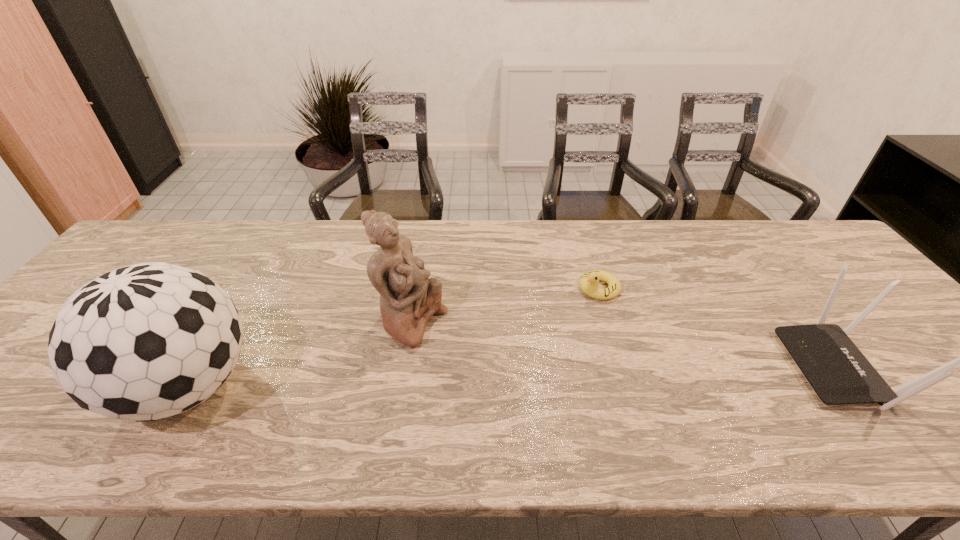
Where is `soccer ball`? soccer ball is located at coordinates (143, 342).

You are a GUI agent. You are given a task and a screenshot of the screen. Output one action in this format:
    pyautogui.click(x=<x>, y=<y>)
    Task: Click on the third tallest object
    
    Given the screenshot: What is the action you would take?
    pyautogui.click(x=838, y=372)

Locate an element on the screen. The height and width of the screenshot is (540, 960). router is located at coordinates (838, 372).

Identify the location of the shortest object. (588, 282).

At what (x,y) coordinates should I click in order to perform the action: click on duckling. Please return your answer as a coordinate pair (x, y). The width and height of the screenshot is (960, 540). Looking at the image, I should click on (588, 282).

Where is `the third object from right to left`? This screenshot has width=960, height=540. the third object from right to left is located at coordinates (408, 299).

The height and width of the screenshot is (540, 960). What are the coordinates of `vacant region located on the back of the soccer ball` in the screenshot? It's located at (238, 301).

The width and height of the screenshot is (960, 540). I want to click on free space located on the front-facing side of the second shortest object, so click(x=767, y=368).

Where is `vacant region located on the front-facing side of the second shortest object`? This screenshot has width=960, height=540. vacant region located on the front-facing side of the second shortest object is located at coordinates (754, 368).

This screenshot has height=540, width=960. Identify the location of vacant space located 0.060m on the front-facing side of the second shortest object. (767, 368).